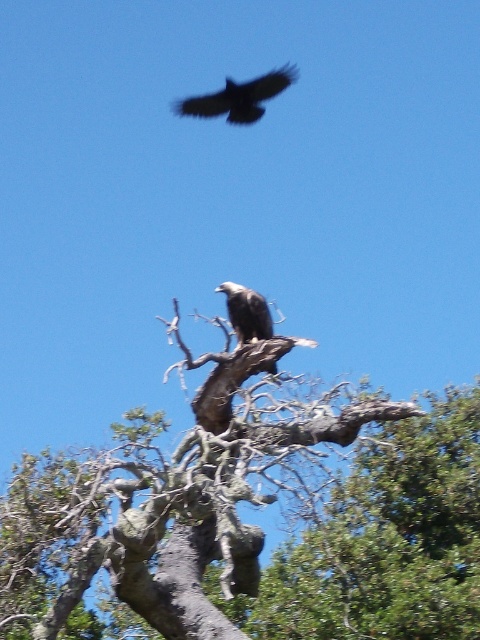
Question: Where is dark brown eagle at upper center located in relation to dark brown feathers at center in the image?

Choices:
 (A) below
 (B) above

Answer: (B)

Question: Which object appears closest to the camera in this image?

Choices:
 (A) dark brown feathers at center
 (B) dark brown eagle at upper center
 (C) gray bark tree trunk at center

Answer: (C)

Question: Is gray bark tree trunk at center above dark brown eagle at upper center?

Choices:
 (A) no
 (B) yes

Answer: (A)

Question: Does gray bark tree trunk at center have a smaller size compared to dark brown feathers at center?

Choices:
 (A) no
 (B) yes

Answer: (A)

Question: Which point is farther to the camera?

Choices:
 (A) gray bark tree trunk at center
 (B) dark brown feathers at center

Answer: (B)

Question: Based on their relative distances, which object is farther from the gray bark tree trunk at center?

Choices:
 (A) dark brown feathers at center
 (B) dark brown eagle at upper center

Answer: (B)